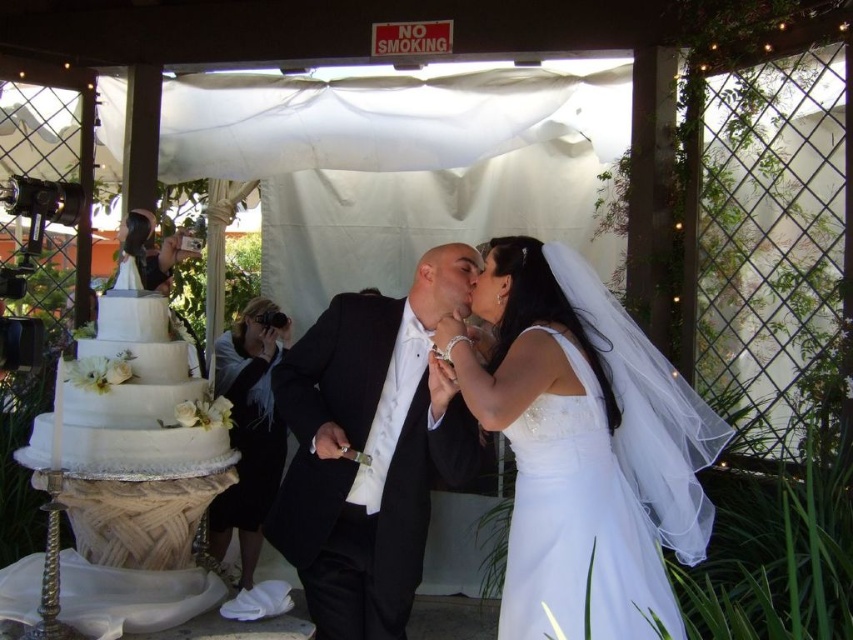
Which is in front, point (541, 268) or point (457, 449)?

Positioned in front is point (541, 268).

Between white satin dress at center and black satin tuxedo at center, which one appears on the left side from the viewer's perspective?

From the viewer's perspective, black satin tuxedo at center appears more on the left side.

Identify the location of white satin dress at center. This screenshot has height=640, width=853. (584, 445).

What are the coordinates of `white satin dress at center` in the screenshot? It's located at (584, 445).

Is black satin tuxedo at center closer to camera compared to white fondant cake at left?

No, black satin tuxedo at center is further to the viewer.

Is black satin tuxedo at center taller than white fondant cake at left?

Yes.

The width and height of the screenshot is (853, 640). What do you see at coordinates (370, 445) in the screenshot? I see `black satin tuxedo at center` at bounding box center [370, 445].

Locate an element on the screen. This screenshot has height=640, width=853. black satin tuxedo at center is located at coordinates (370, 445).

Which is behind, point (491, 369) or point (44, 445)?

The point (491, 369) is behind.

Is white satin dress at center taller than white fondant cake at left?

Correct, white satin dress at center is much taller as white fondant cake at left.

Is point (628, 362) more distant than point (186, 436)?

No.

I want to click on white satin dress at center, so click(x=584, y=445).